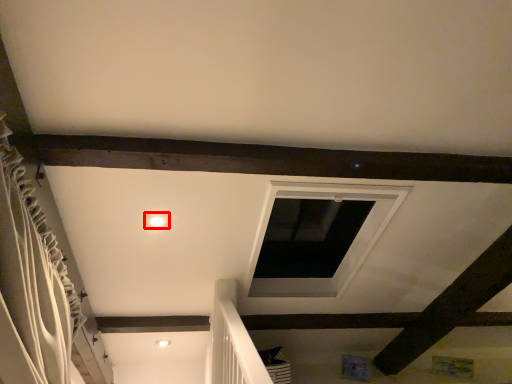
Question: From the image's perspective, where is lighting (annotated by the red box) located in relation to curtain in the image?

Choices:
 (A) below
 (B) above

Answer: (B)